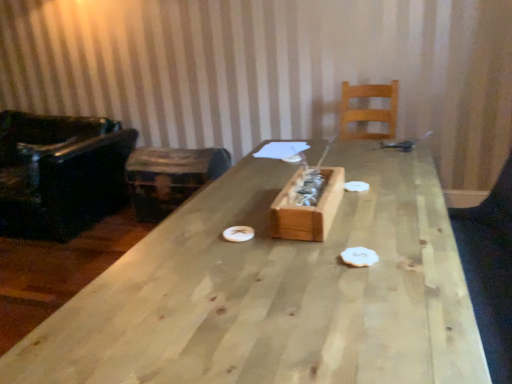
In order to click on free space in front of wooden box at center in this screenshot , I will do `click(330, 255)`.